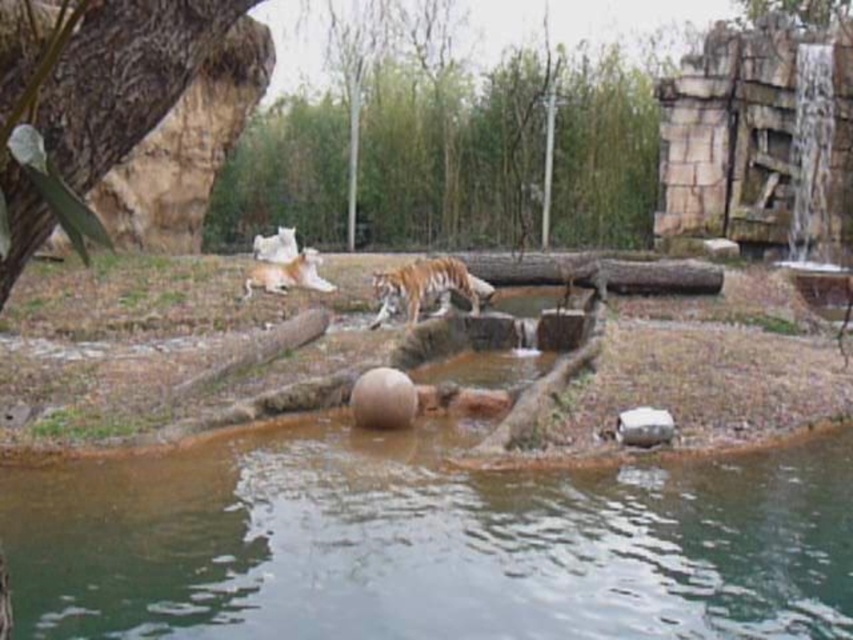
You are a zookeeper standing at the edge of the shallow pool in the middle ground. You need to approach the tiger to provide food. Which tiger should you approach first, the orange striped fur tiger at center or the orange fur tiger at center, and why?

Both the orange striped fur tiger at center and the orange fur tiger at center are the same tiger. The description mentions they are 3.09 meters apart, but since they are the same animal, you should approach either one as they are the same individual. However, since there is only one tiger, you can approach it directly without needing to choose between two.

You are a zookeeper planning to install a new feeding station for the tiger. The station must be placed in a location where it is visible from both the rough bark tree at upper left and the orange striped fur tiger at center. Based on their positions, is this possible?

The rough bark tree at upper left is above the orange striped fur tiger at center, so the feeding station can be placed in a position where it is visible from both locations since they are vertically aligned.

Wait, the two objects are both tigers at center. How can one be under the other? Maybe it was a typo. Let me check the input again. The user provided two objects with similar names but slightly different descriptions. The first is orange striped fur tiger at center, and the second is orange fur tiger at center. The description says the first is under the second. So the question should ask about their positions. Since they are both at center, but one is under the other, perhaps they are overlapping. The user

The orange striped fur tiger at center is positioned under the orange fur tiger at center, meaning it is located below the other tiger in the image.